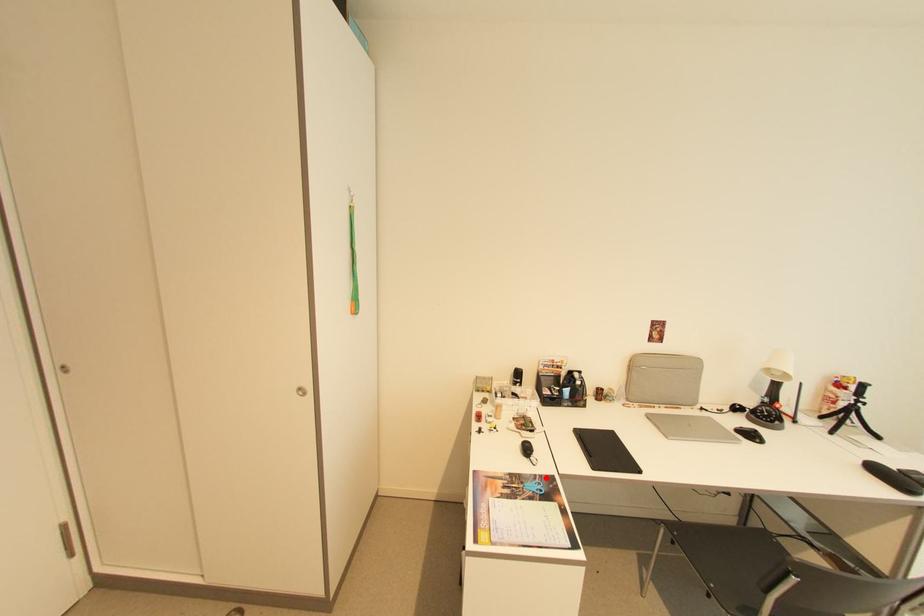
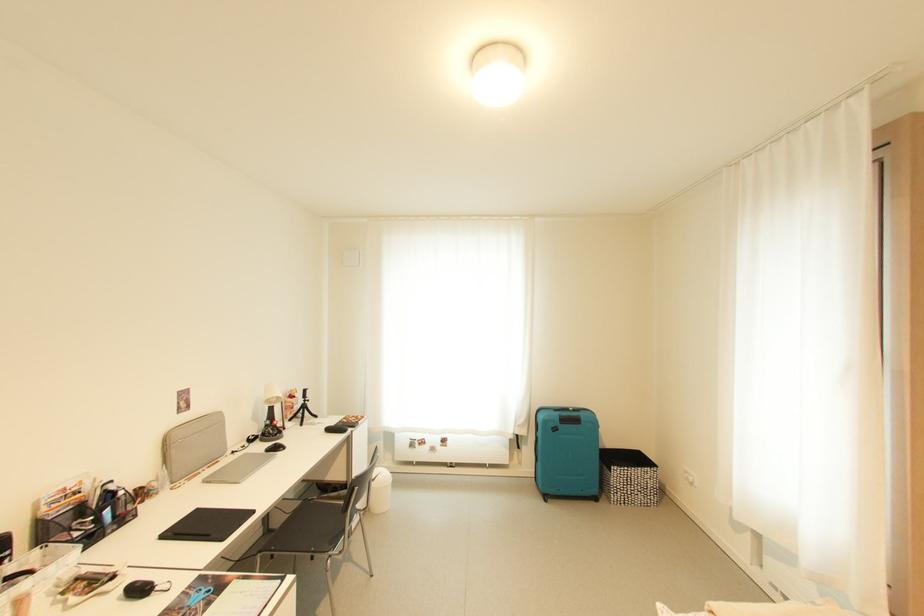
Find the pixel in the second image that matches the highlighted location in the first image.

(195, 589)